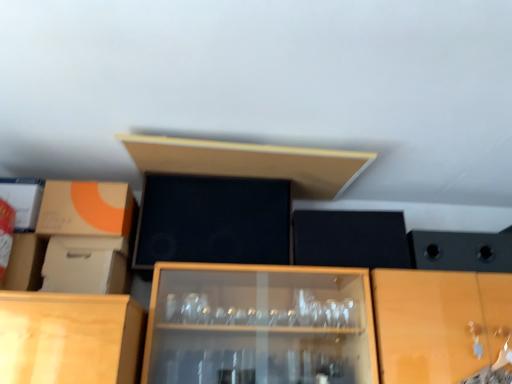
Question: Looking at their shapes, would you say matte cardboard box at left, the second cardboard box positioned from the bottom, is wider or thinner than black matte speaker at center?

Choices:
 (A) wide
 (B) thin

Answer: (A)

Question: Is matte cardboard box at left, the second cardboard box positioned from the bottom, in front of or behind black matte speaker at center in the image?

Choices:
 (A) behind
 (B) front

Answer: (B)

Question: Which is nearer to the matte wood shelf at upper center?

Choices:
 (A) matte cardboard box at left, which is the first cardboard box from top to bottom
 (B) white cardboard box at left, which is counted as the 1th cardboard box, starting from the bottom
 (C) black matte speaker at center

Answer: (C)

Question: Estimate the real-world distances between objects in this image. Which object is farther from the matte wood shelf at upper center?

Choices:
 (A) black matte speaker at center
 (B) white cardboard box at left, arranged as the second cardboard box when viewed from the top
 (C) matte cardboard box at left, which is the first cardboard box from top to bottom

Answer: (B)